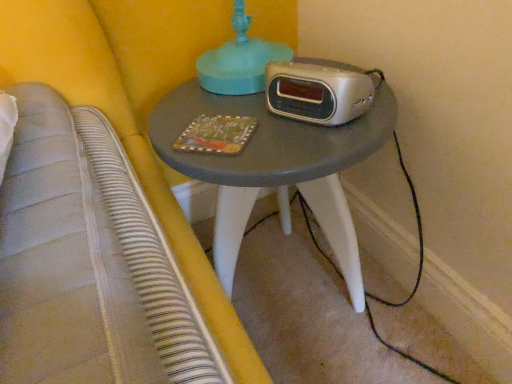
The width and height of the screenshot is (512, 384). What are the coordinates of `vacant area located to the right-hand side of wooden painted book at center` in the screenshot? It's located at (302, 128).